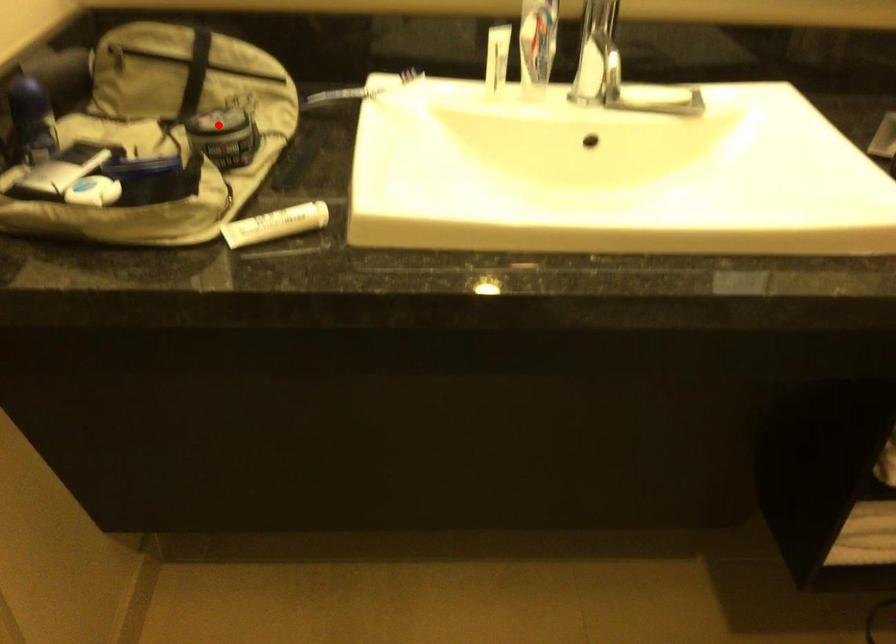
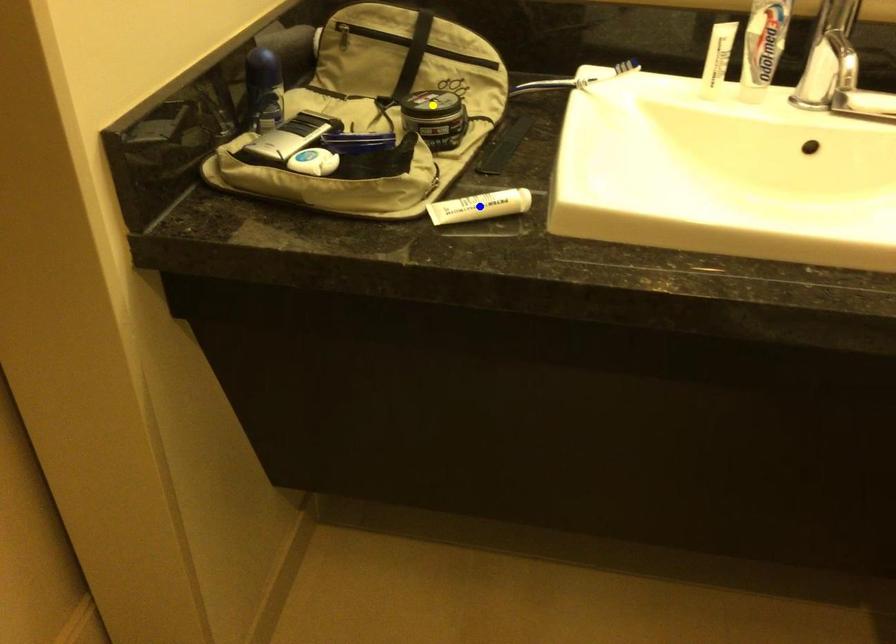
Question: I am providing you with two images of the same scene from different viewpoints. A red point is marked on the first image. You are given multiple points on the second image. Which point in image 2 represents the same 3d spot as the red point in image 1?

Choices:
 (A) green point
 (B) blue point
 (C) yellow point

Answer: (C)